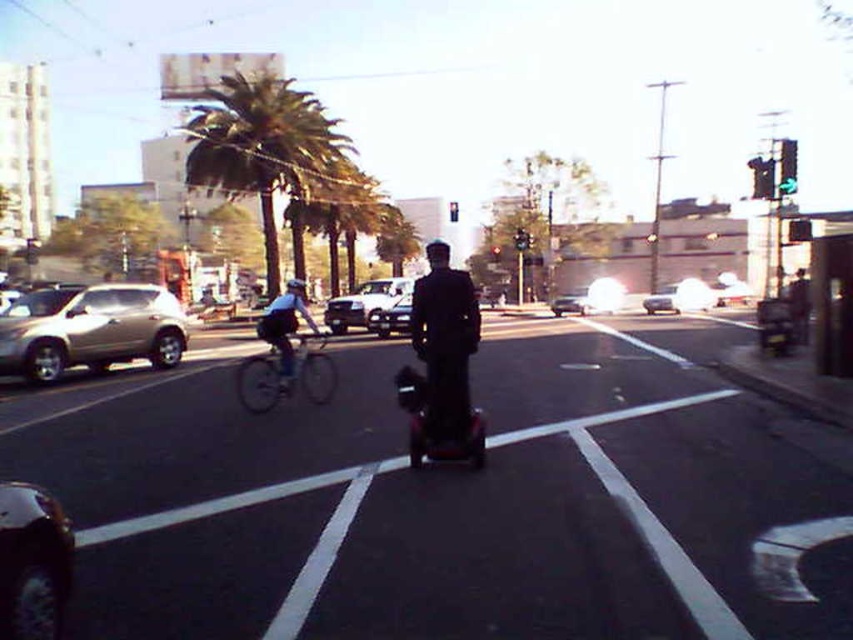
You are a delivery person on a black matte hoverboard at center and need to deliver a package to a location behind the green leafy palm tree at upper center. Can you reach the destination without moving the hoverboard?

The black matte hoverboard at center is in front of the green leafy palm tree at upper center, so you cannot reach the destination without moving the hoverboard because the hoverboard is blocking the path to the tree.

You are a pedestrian standing at the edge of the road and want to cross to the sidewalk on the other side. There is a satin gold suv at left and a silver metallic sedan at center in your path. Which vehicle should you avoid first while crossing?

You should avoid the satin gold suv at left first because it is closer to you than the silver metallic sedan at center.

You are standing at the origin point of the coordinate system in this street scene. You see the black matte hoverboard at center. What are the coordinates of the hoverboard?

The coordinates of the black matte hoverboard at center are at point (456, 500).